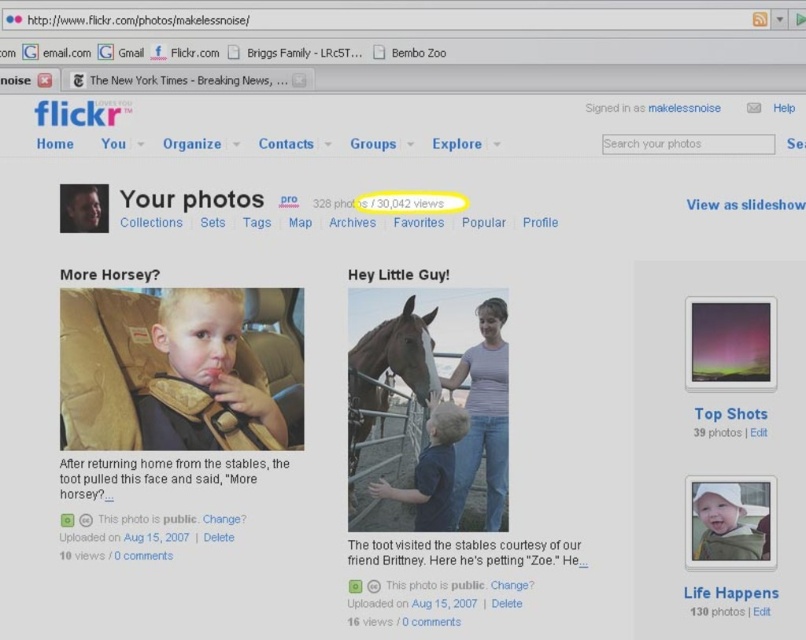
Consider the image. You are a photographer reviewing your Flickr page. You notice the purple aurora at upper right and the blue matte shirt at center. Which object appears closer to you in the featured photo?

The purple aurora at upper right appears closer to you because it is in front of the blue matte shirt at center.

You are a user trying to determine if the brown glossy horse at center in the featured photo on your Flickr page is larger than the white plastic sign at upper center. Can you confirm this based on the image?

The brown glossy horse at center is much taller than the white plastic sign at upper center, so yes, the brown glossy horse at center is larger in height compared to the white plastic sign at upper center.

You are a Flickr user looking at the featured photo titled More Horsey?. According to the image, is the blonde hair baby at center positioned to the left or right of the brown glossy horse at center?

The blonde hair baby at center is to the left of the brown glossy horse at center.